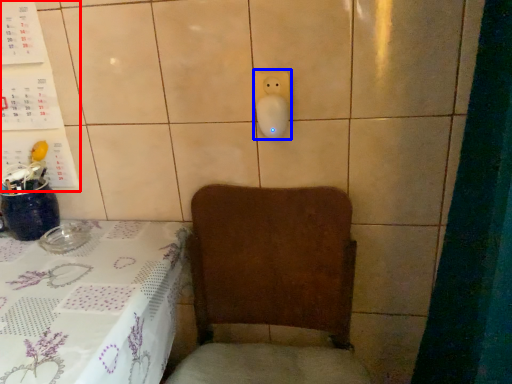
Question: Which point is closer to the camera, bulletin board (highlighted by a red box) or electric outlet (highlighted by a blue box)?

Choices:
 (A) bulletin board
 (B) electric outlet

Answer: (B)